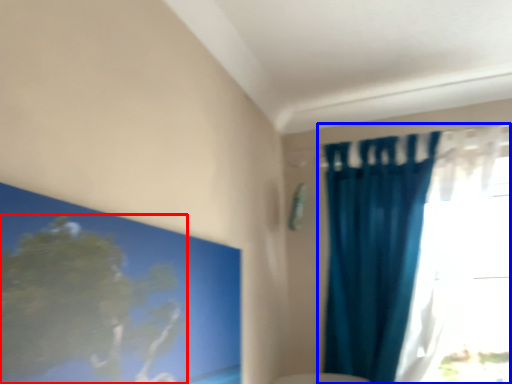
Question: Which point is closer to the camera, tree (highlighted by a red box) or curtain (highlighted by a blue box)?

Choices:
 (A) tree
 (B) curtain

Answer: (A)